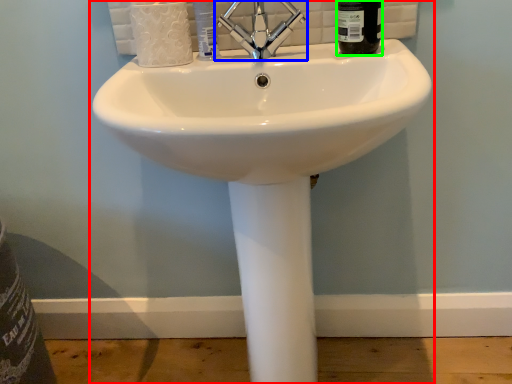
Question: Which object is the closest to the sink (highlighted by a red box)? Choose among these: tap (highlighted by a blue box) or liquid (highlighted by a green box).

Choices:
 (A) tap
 (B) liquid

Answer: (A)